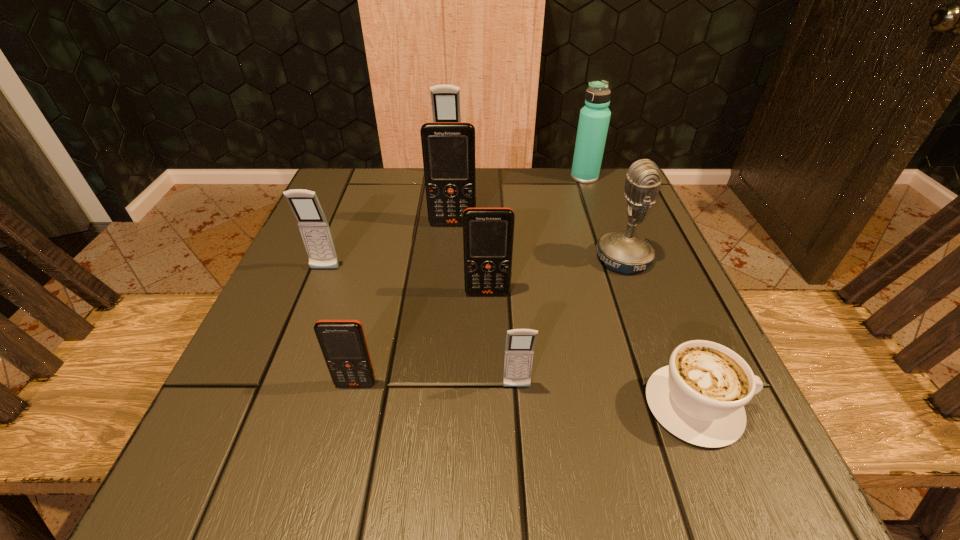
Where is `vacant space that's between the farthest orange cellular telephone and the microphone`? The height and width of the screenshot is (540, 960). vacant space that's between the farthest orange cellular telephone and the microphone is located at coordinates (538, 241).

The image size is (960, 540). I want to click on free spot between the microphone and the smallest gray cellular telephone, so click(x=570, y=322).

Locate an element on the screen. The width and height of the screenshot is (960, 540). empty location between the aqua thermos bottle and the farthest gray cellular telephone is located at coordinates (517, 176).

Find the location of a particular element. vacant area that lies between the farthest gray cellular telephone and the aqua thermos bottle is located at coordinates (517, 176).

Where is `free space between the biggest gray cellular telephone and the cappuccino`? The width and height of the screenshot is (960, 540). free space between the biggest gray cellular telephone and the cappuccino is located at coordinates (572, 290).

The width and height of the screenshot is (960, 540). What are the coordinates of `the fourth closest object to the second biggest orange cellular telephone` in the screenshot? It's located at (343, 344).

Select which object is the third closest to the aqua thermos bottle. Please provide its 2D coordinates. Your answer should be formatted as a tuple, i.e. [(x, y)], where the tuple contains the x and y coordinates of a point satisfying the conditions above.

[(448, 148)]

Identify which cellular telephone is located as the third nearest to the rightmost gray cellular telephone. Please provide its 2D coordinates. Your answer should be formatted as a tuple, i.e. [(x, y)], where the tuple contains the x and y coordinates of a point satisfying the conditions above.

[(313, 225)]

At what (x,y) coordinates should I click in order to perform the action: click on cellular telephone that can be found as the sixth closest to the microphone. Please return your answer as a coordinate pair (x, y). This screenshot has width=960, height=540. Looking at the image, I should click on point(313,225).

Identify which gray cellular telephone is located as the nearest to the microphone. Please provide its 2D coordinates. Your answer should be formatted as a tuple, i.e. [(x, y)], where the tuple contains the x and y coordinates of a point satisfying the conditions above.

[(520, 343)]